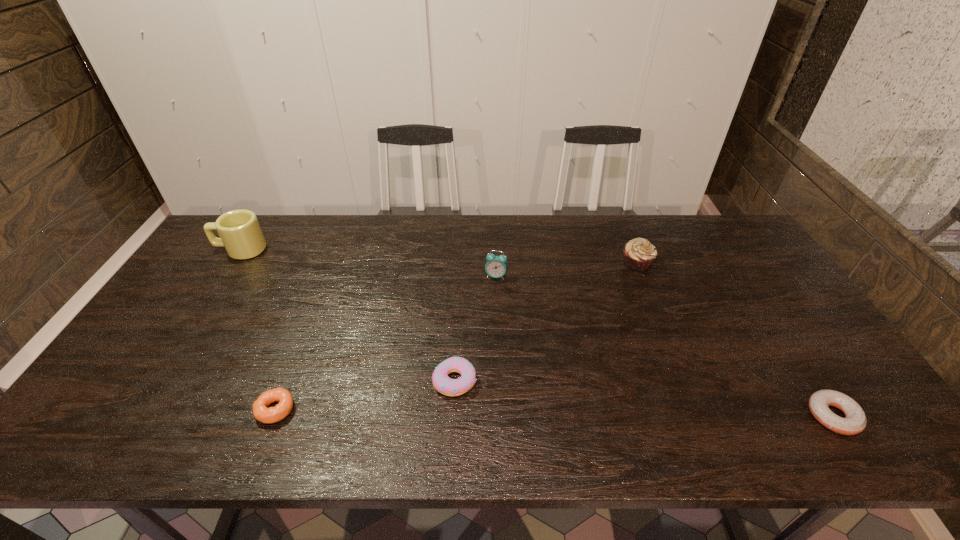
This screenshot has height=540, width=960. I want to click on blank space at the left edge of the desktop, so click(175, 331).

Image resolution: width=960 pixels, height=540 pixels. In order to click on free point at the right edge in this screenshot , I will do `click(809, 375)`.

This screenshot has height=540, width=960. In the image, there is a desktop. Find the location of `free space at the near left corner`. free space at the near left corner is located at coordinates (69, 438).

This screenshot has height=540, width=960. What are the coordinates of `free area in between the fourth object from right to left and the second object from right to left` in the screenshot? It's located at (545, 322).

In order to click on unoccupied position between the fifth object from left to right and the fourth object from right to left in this screenshot , I will do `click(545, 322)`.

At what (x,y) coordinates should I click in order to perform the action: click on empty space that is in between the leftmost object and the leftmost doughnut. Please return your answer as a coordinate pair (x, y). Looking at the image, I should click on (258, 329).

You are a GUI agent. You are given a task and a screenshot of the screen. Output one action in this format:
    pyautogui.click(x=<x>, y=<y>)
    Task: Click on the empty location between the alarm clock and the rightmost doughnut
    
    Given the screenshot: What is the action you would take?
    pyautogui.click(x=664, y=346)

Image resolution: width=960 pixels, height=540 pixels. Find the location of `blank region between the third object from right to left and the fourth object from right to left`. blank region between the third object from right to left and the fourth object from right to left is located at coordinates (475, 328).

Where is `vacant space that is in between the rightmost doughnut and the third object from right to left`? This screenshot has height=540, width=960. vacant space that is in between the rightmost doughnut and the third object from right to left is located at coordinates [x=664, y=346].

This screenshot has width=960, height=540. Find the location of `free point between the fourth object from left to right and the fourth object from right to left`. free point between the fourth object from left to right and the fourth object from right to left is located at coordinates (475, 328).